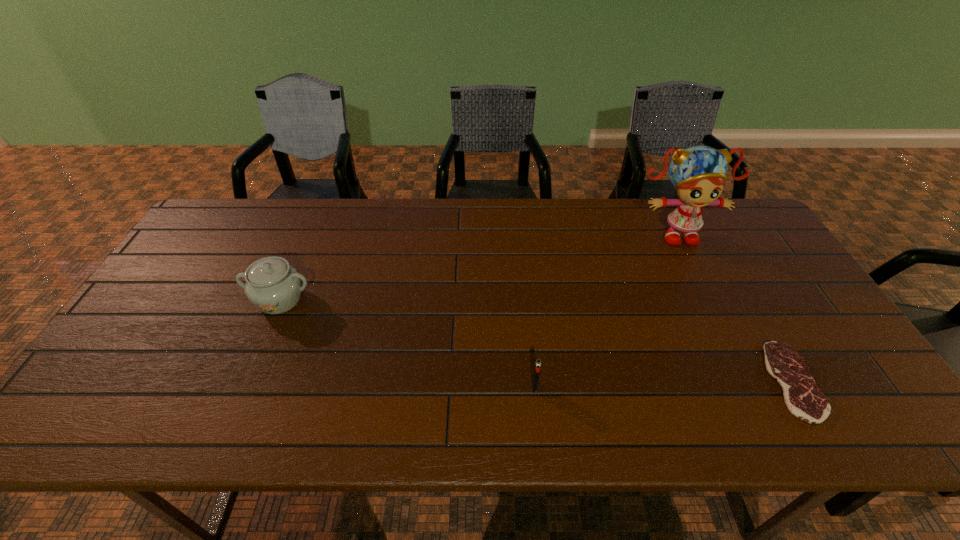
This screenshot has height=540, width=960. Find the location of `the tallest object`. the tallest object is located at coordinates (698, 173).

You are a GUI agent. You are given a task and a screenshot of the screen. Output one action in this format:
    pyautogui.click(x=<x>, y=<y>)
    Task: Click on the doll
    The height and width of the screenshot is (540, 960).
    Given the screenshot: What is the action you would take?
    pyautogui.click(x=698, y=173)

Image resolution: width=960 pixels, height=540 pixels. What are the coordinates of `the third nearest object` in the screenshot? It's located at (272, 285).

This screenshot has height=540, width=960. Identify the location of the second tallest object. (272, 285).

Find the location of a particular element. The width and height of the screenshot is (960, 540). the third tallest object is located at coordinates (538, 362).

I want to click on igniter, so click(538, 362).

You are a GUI agent. You are given a task and a screenshot of the screen. Output one action in this format:
    pyautogui.click(x=<x>, y=<y>)
    Task: Click on the steak
    
    Given the screenshot: What is the action you would take?
    pyautogui.click(x=804, y=399)

At what (x,y) coordinates should I click in order to perform the action: click on free location located on the face of the doll. Please return your answer as a coordinate pair (x, y). Looking at the image, I should click on (688, 260).

Image resolution: width=960 pixels, height=540 pixels. Find the location of `free region located on the left of the third shortest object`. free region located on the left of the third shortest object is located at coordinates pyautogui.click(x=167, y=300).

At what (x,y) coordinates should I click in order to perform the action: click on free space located 0.080m on the left of the igniter. Please return your answer as a coordinate pair (x, y). The width and height of the screenshot is (960, 540). Looking at the image, I should click on [497, 387].